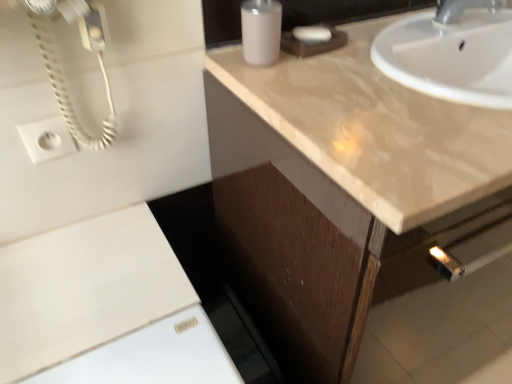
Identify the location of vacant space situated above white matte cabinet at lower left (from a real-world perspective). The image size is (512, 384). (90, 274).